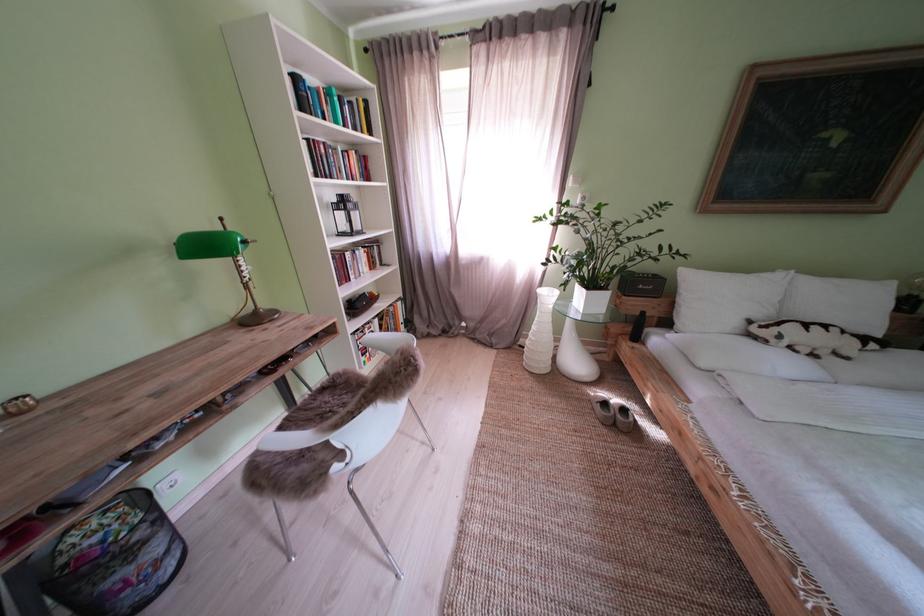
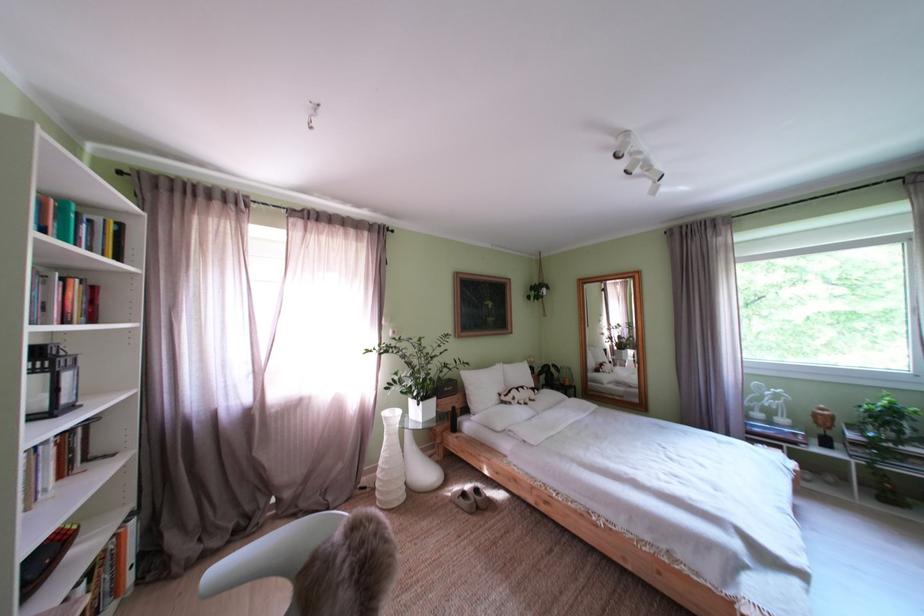
The point at [792,342] is marked in the first image. Where is the corresponding point in the second image?

(525, 405)